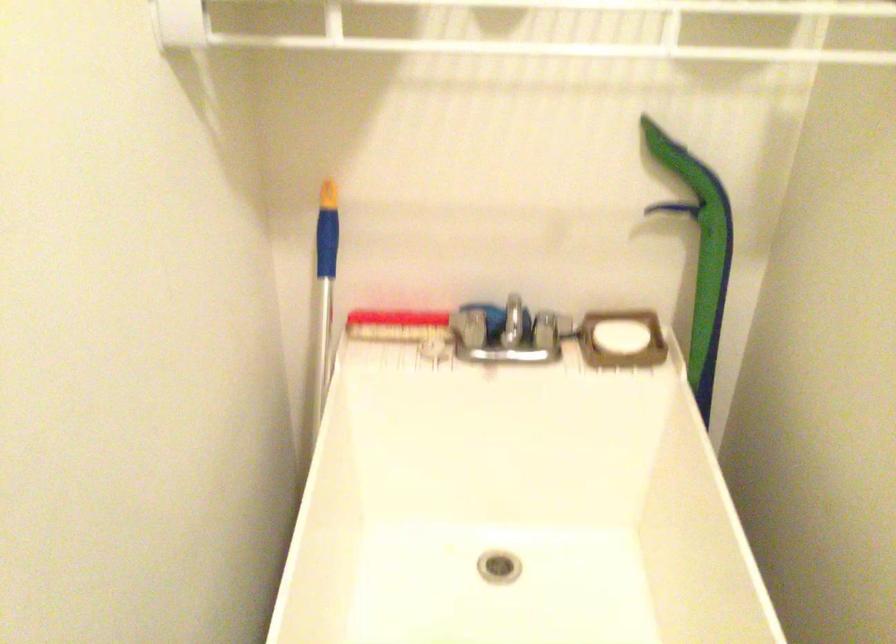
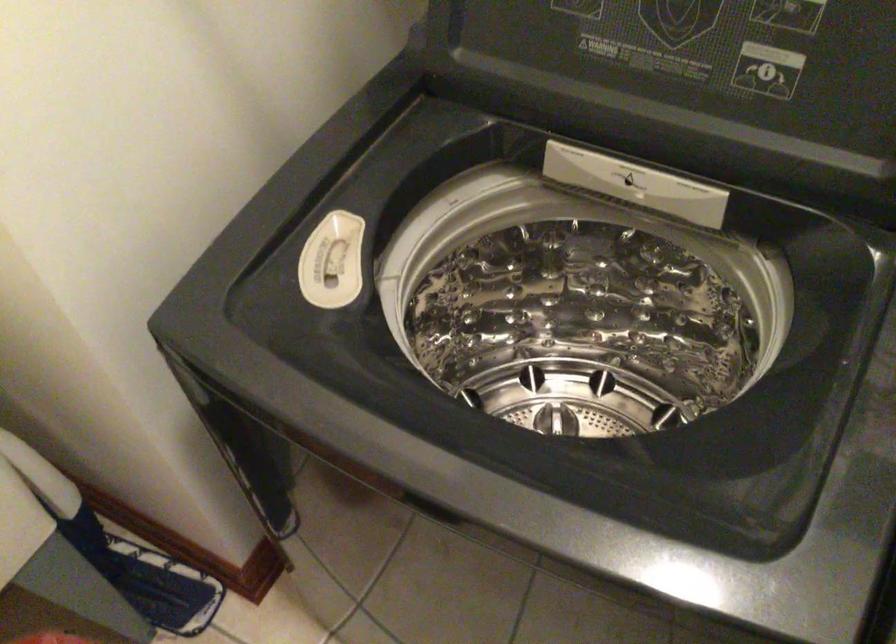
How did the camera likely rotate?

The camera's rotation is toward right-down.